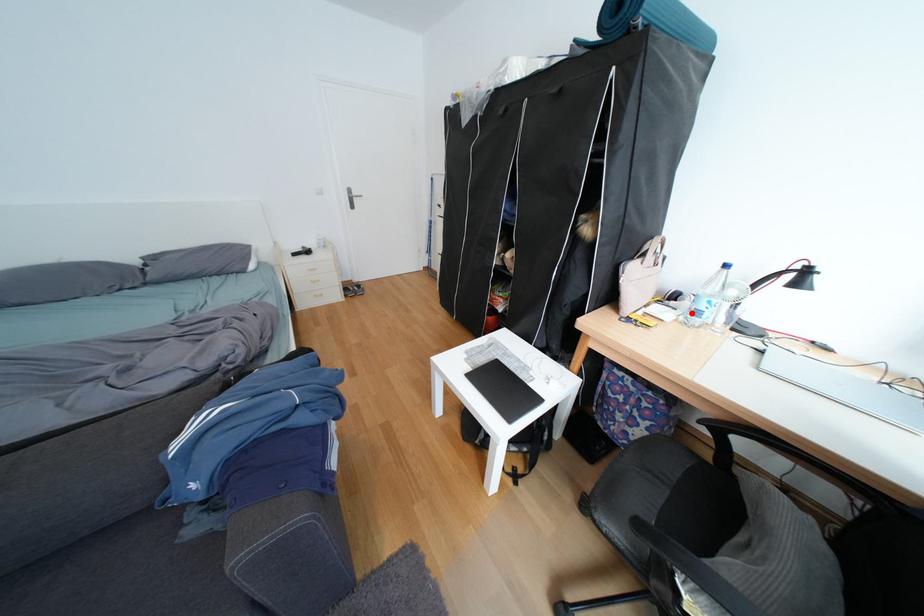
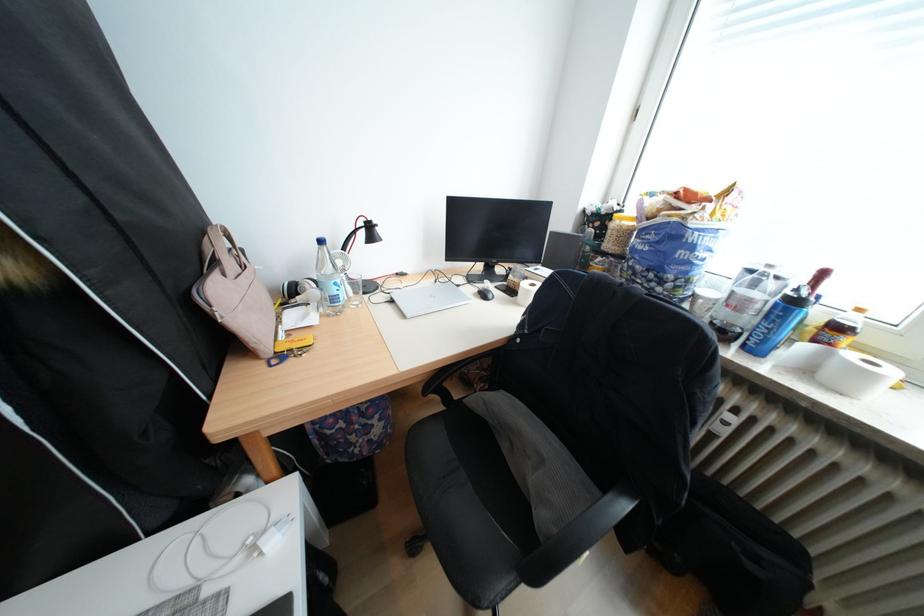
Locate, in the second image, the point that corresponds to the highlighted location in the first image.

(325, 306)